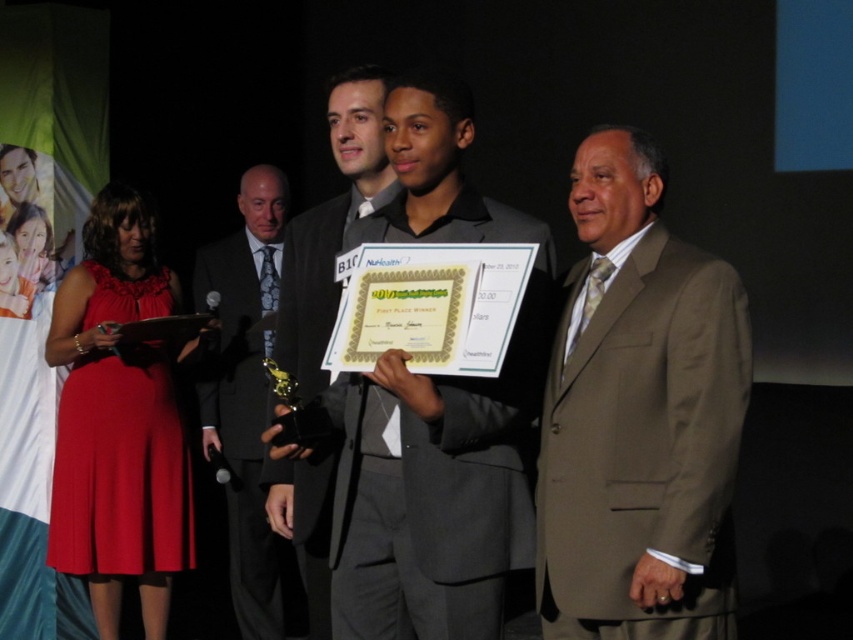
You are a photographer at the event and need to focus your camera on the tan suit at right and dark gray suit at left. Which one should you adjust the focus for first to ensure it appears sharp in the photo?

The tan suit at right is closer to the viewer than the dark gray suit at left, so you should focus on the tan suit at right first. Adjusting focus for closer objects ensures proper sharpness before moving to those further away.

You are a photographer at the event and need to capture a photo where both the tan suit at right and the matte black suit at center are visible. Based on their positions, which one is lower in the frame?

The tan suit at right is positioned under the matte black suit at center, so it will appear lower in the frame.

You are organizing a photo shoot and need to arrange two men wearing the tan suit at right and dark gray suit at left side by side. Which suit will require more space between them to avoid overlapping?

The tan suit at right requires more space between the two suits because its width is larger than the dark gray suit at left.